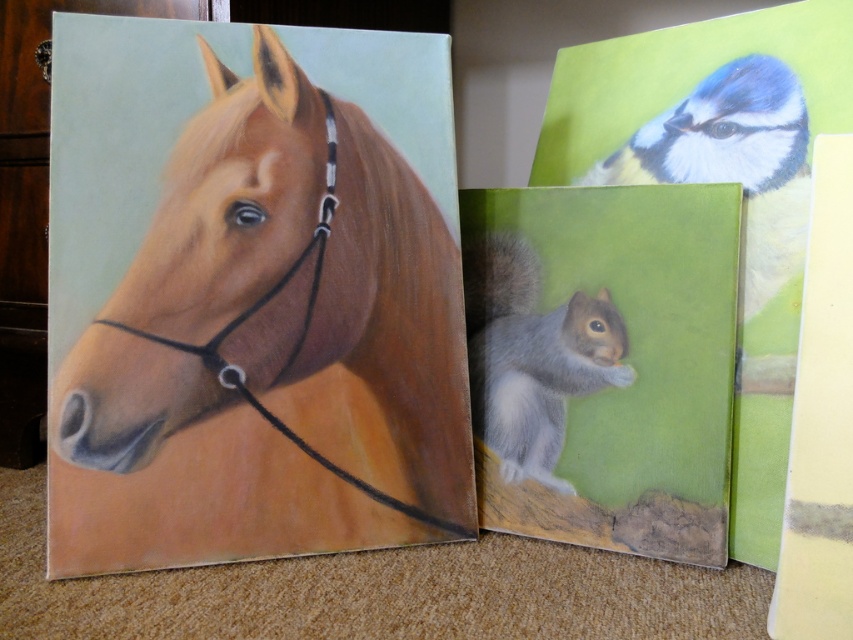
From the picture: Is gray furry squirrel at center bigger than satin black bridle at left?

No.

Who is positioned more to the left, gray furry squirrel at center or satin black bridle at left?

Positioned to the left is satin black bridle at left.

Who is more distant from viewer, (480,246) or (265,301)?

The point (480,246) is more distant.

This screenshot has height=640, width=853. I want to click on gray furry squirrel at center, so click(532, 355).

Does point (440, 394) come behind point (312, 244)?

Yes.

Does matte brown horse at left appear on the left side of satin black bridle at left?

In fact, matte brown horse at left is to the right of satin black bridle at left.

The width and height of the screenshot is (853, 640). I want to click on matte brown horse at left, so click(280, 289).

Which is more to the left, blue glossy bird at upper right or gray furry squirrel at center?

gray furry squirrel at center is more to the left.

Between point (805, 193) and point (527, 289), which one is positioned in front?

Point (805, 193) is in front.

Does point (726, 145) come closer to viewer compared to point (469, 387)?

Yes, it is.

Identify the location of blue glossy bird at upper right. The width and height of the screenshot is (853, 640). (733, 161).